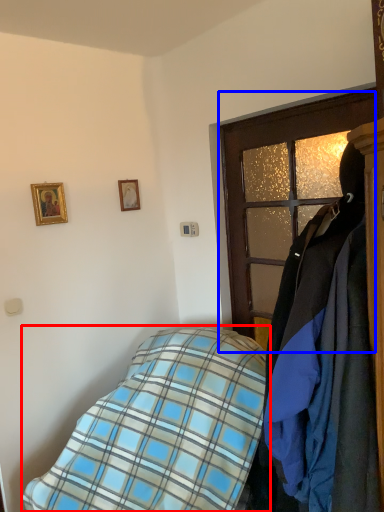
Question: Among these objects, which one is farthest to the camera, bed (highlighted by a red box) or door (highlighted by a blue box)?

Choices:
 (A) bed
 (B) door

Answer: (B)